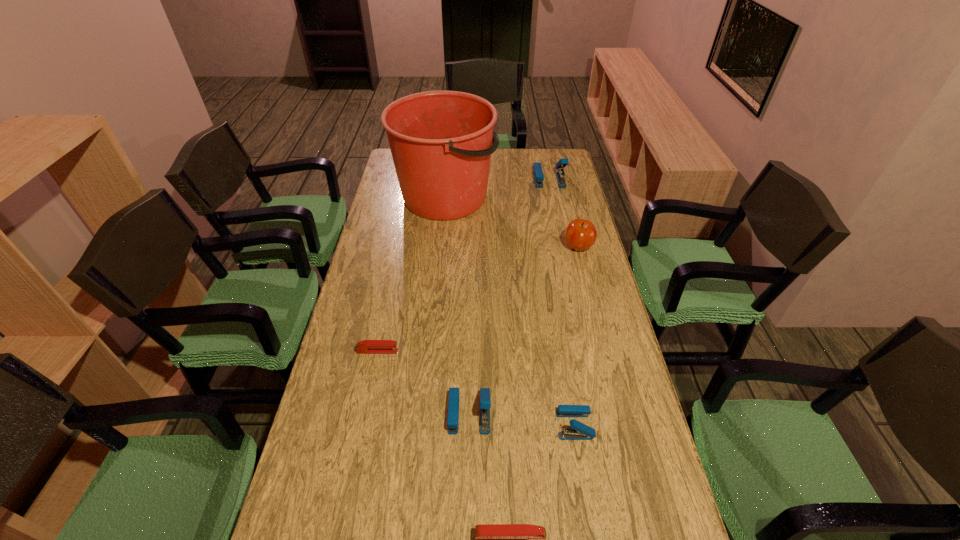
In order to click on stapler that is at the left edge in this screenshot , I will do `click(366, 346)`.

What are the coordinates of `apple at the right edge` in the screenshot? It's located at (580, 234).

Locate an element on the screen. The width and height of the screenshot is (960, 540). object positioned at the far left corner is located at coordinates (441, 142).

Find the location of a particular element. This screenshot has width=960, height=540. object situated at the far right corner is located at coordinates (537, 172).

Locate an element on the screen. This screenshot has width=960, height=540. vacant area at the left edge is located at coordinates (332, 488).

What are the coordinates of `free space at the right edge of the desktop` in the screenshot? It's located at (594, 265).

In the image, there is a desktop. Where is `free space at the far right corner`? free space at the far right corner is located at coordinates (570, 167).

At what (x,y) coordinates should I click in order to perform the action: click on free space between the apple and the fourth shortest object. Please return your answer as a coordinate pair (x, y). The height and width of the screenshot is (540, 960). Looking at the image, I should click on (524, 330).

At what (x,y) coordinates should I click in order to perform the action: click on free space between the farthest stapler and the third farthest object. Please return your answer as a coordinate pair (x, y). This screenshot has width=960, height=540. Looking at the image, I should click on (564, 213).

At what (x,y) coordinates should I click in order to perform the action: click on vacant area that lies between the tallest object and the apple. Please return your answer as a coordinate pair (x, y). Image resolution: width=960 pixels, height=540 pixels. Looking at the image, I should click on 512,222.